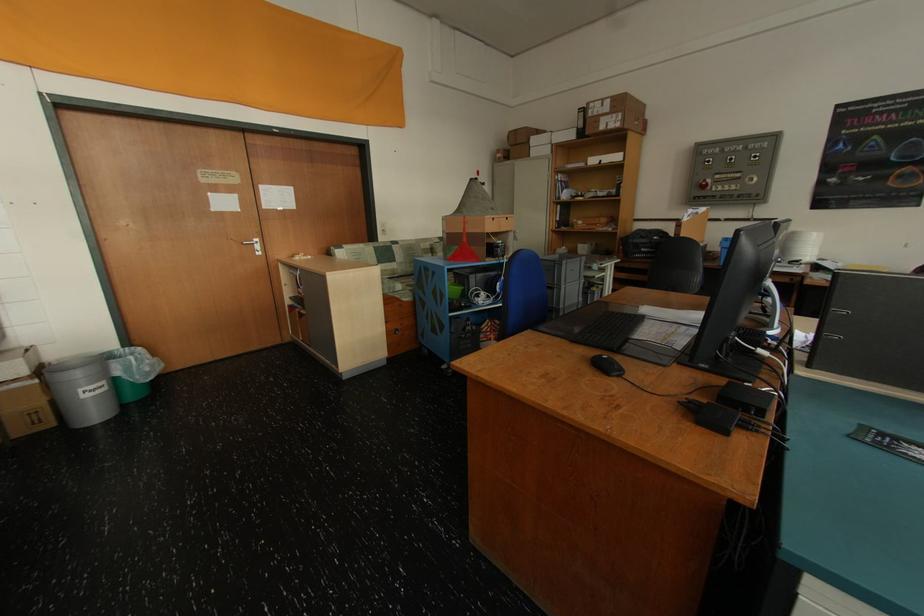
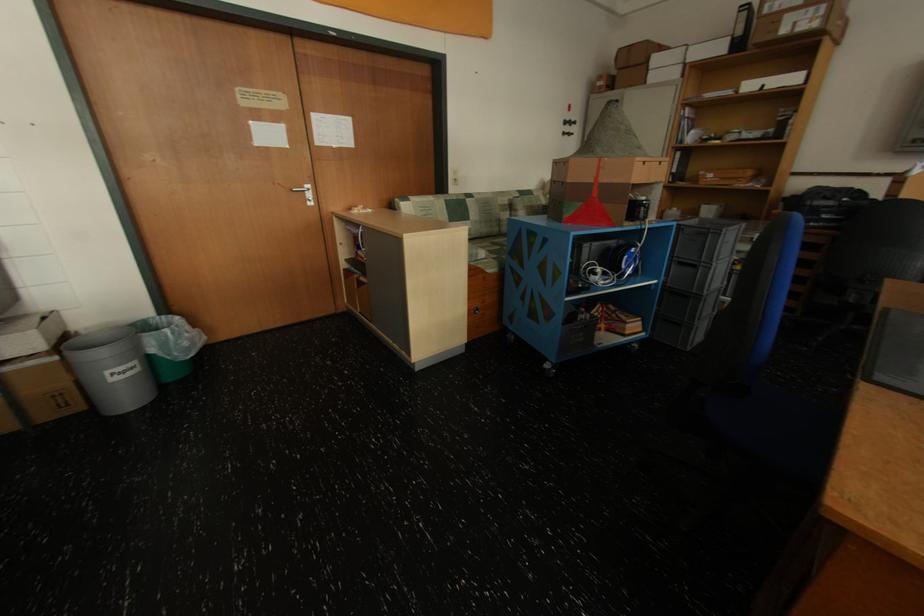
Find the pixel in the second image that matches pixel 579 137 in the first image.

(728, 50)